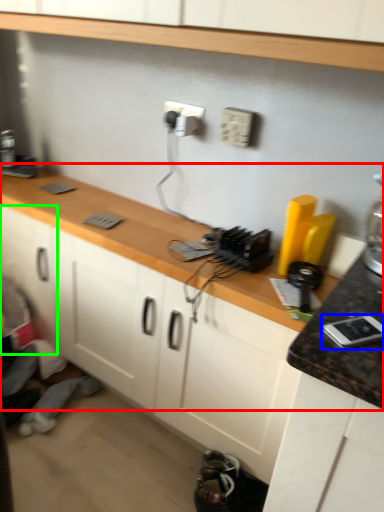
Question: Considering the real-world distances, which object is farthest from countertop (highlighted by a red box)? appliance (highlighted by a blue box) or cabinetry (highlighted by a green box)?

Choices:
 (A) appliance
 (B) cabinetry

Answer: (A)